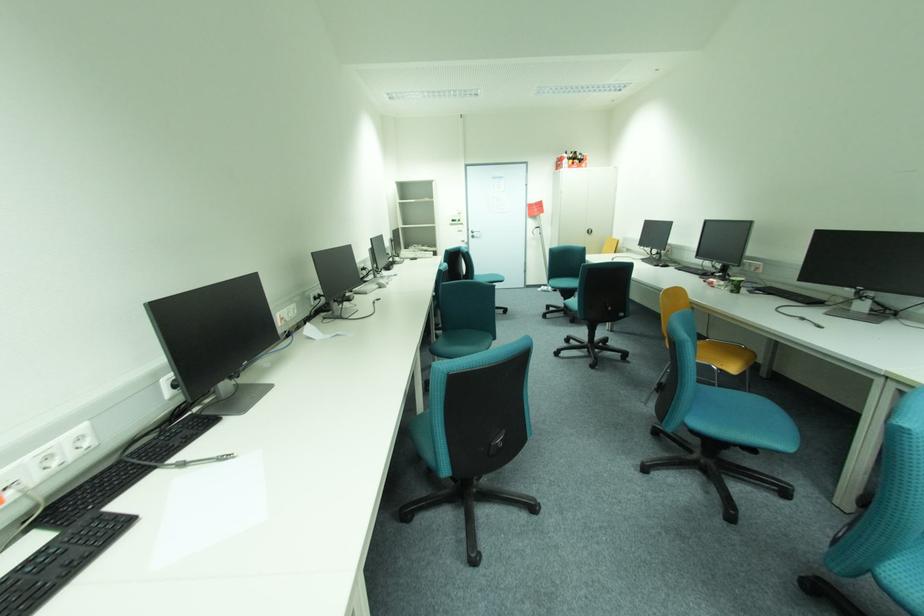
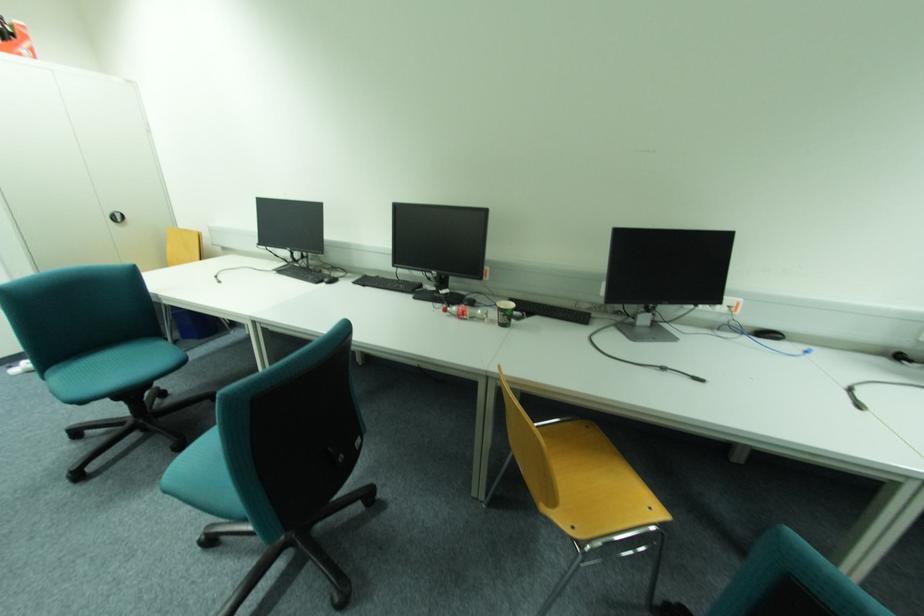
Locate, in the second image, the point that corresponds to point 666,265 in the first image.

(333, 280)